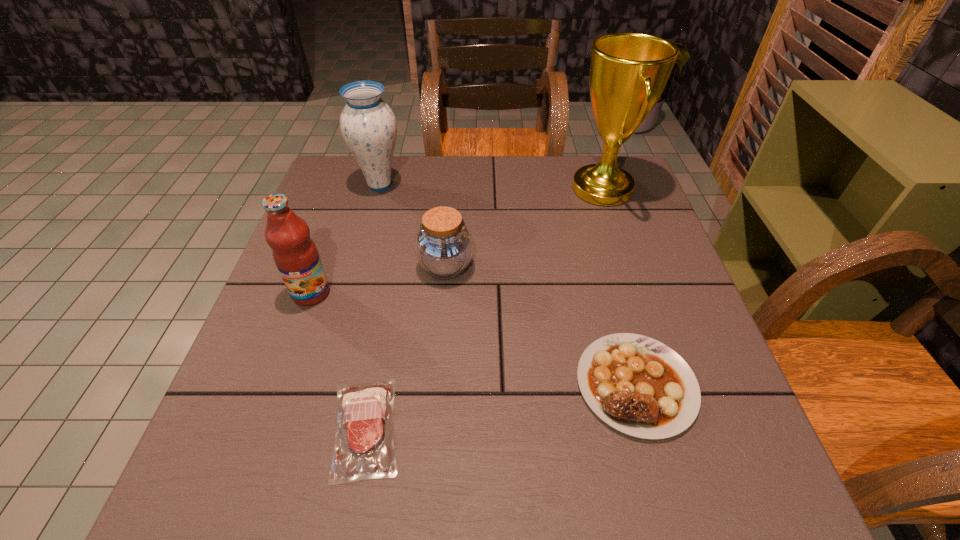
Locate an element on the screen. object that is the second closest to the fourth tallest object is located at coordinates (368, 125).

Find the location of a particular element. free space that satisfies the following two spatial constraints: 1. by the handles of the award; 2. on the front label of the fruit juice is located at coordinates (636, 293).

Identify the location of vacant space that satisfies the following two spatial constraints: 1. on the front side of the jar; 2. on the left side of the vase. This screenshot has width=960, height=540. (358, 267).

Where is `vacant space that satisfies the following two spatial constraints: 1. on the front label of the fruit juice; 2. on the left side of the right steak`? vacant space that satisfies the following two spatial constraints: 1. on the front label of the fruit juice; 2. on the left side of the right steak is located at coordinates (278, 384).